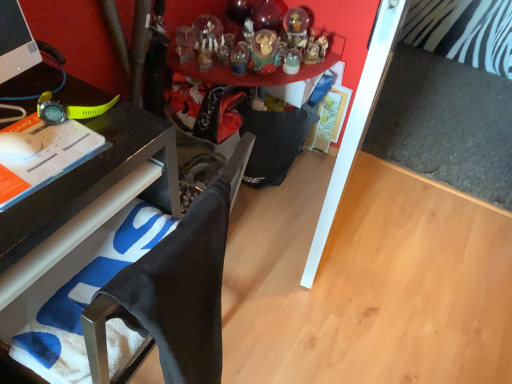
Question: Is there a large distance between translucent glass ornament at upper center, the 1th toy from the top, and matte black watch at left?

Choices:
 (A) yes
 (B) no

Answer: (A)

Question: From the image's perspective, is translucent glass ornament at upper center, the 3th toy from the bottom, on top of matte black watch at left?

Choices:
 (A) no
 (B) yes

Answer: (B)

Question: From a real-world perspective, is translucent glass ornament at upper center, the 3th toy from the bottom, located higher than matte black watch at left?

Choices:
 (A) no
 (B) yes

Answer: (A)

Question: Is translucent glass ornament at upper center, the 1th toy from the top, turned away from matte black watch at left?

Choices:
 (A) no
 (B) yes

Answer: (A)

Question: Would you say translucent glass ornament at upper center, the 3th toy from the bottom, is outside matte black watch at left?

Choices:
 (A) no
 (B) yes

Answer: (B)

Question: Is translucent glass ornament at upper center, the 1th toy from the top, bigger than matte black watch at left?

Choices:
 (A) yes
 (B) no

Answer: (A)

Question: Is translucent glass snow globe at upper center, the second toy when ordered from bottom to top, placed right next to translucent glass ornament at upper center, the third toy positioned from the top?

Choices:
 (A) no
 (B) yes

Answer: (A)

Question: Is translucent glass snow globe at upper center, the 2th toy viewed from the top, positioned far away from translucent glass ornament at upper center, the third toy positioned from the top?

Choices:
 (A) no
 (B) yes

Answer: (A)

Question: Does translucent glass snow globe at upper center, the 2th toy viewed from the top, have a greater height compared to translucent glass ornament at upper center, which appears as the first toy when ordered from the bottom?

Choices:
 (A) yes
 (B) no

Answer: (B)

Question: From the image's perspective, is translucent glass snow globe at upper center, the 2th toy viewed from the top, under translucent glass ornament at upper center, the third toy positioned from the top?

Choices:
 (A) no
 (B) yes

Answer: (A)

Question: From the image's perspective, does translucent glass snow globe at upper center, the second toy when ordered from bottom to top, appear higher than translucent glass ornament at upper center, which appears as the first toy when ordered from the bottom?

Choices:
 (A) yes
 (B) no

Answer: (A)

Question: Does translucent glass snow globe at upper center, the second toy when ordered from bottom to top, turn towards translucent glass ornament at upper center, which appears as the first toy when ordered from the bottom?

Choices:
 (A) no
 (B) yes

Answer: (B)

Question: From the image's perspective, is matte black watch at left above black fabric computer chair at lower left?

Choices:
 (A) yes
 (B) no

Answer: (A)